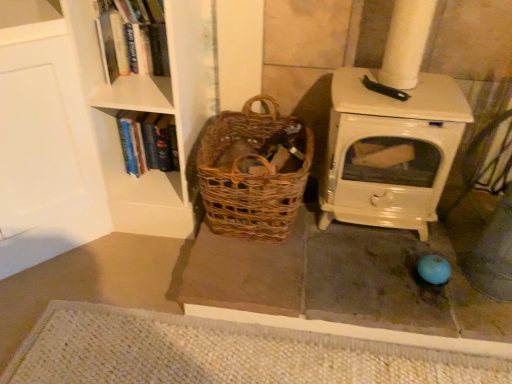
Question: Is hardcover book at upper left, which is the 2th book in back-to-front order, in front of or behind hardcover book at left, the 2th book from the top, in the image?

Choices:
 (A) behind
 (B) front

Answer: (B)

Question: In terms of width, does hardcover book at upper left, the 2th book positioned from the bottom, look wider or thinner when compared to hardcover book at left, which is the first book in bottom-to-top order?

Choices:
 (A) wide
 (B) thin

Answer: (B)

Question: Considering the real-world distances, which object is farthest from the hardcover book at upper left, the 2th book positioned from the bottom?

Choices:
 (A) white woven mat at lower center
 (B) woven brown basket at center
 (C) hardcover book at left, placed as the first book when sorted from back to front

Answer: (A)

Question: Considering the real-world distances, which object is closest to the hardcover book at left, which is the first book in bottom-to-top order?

Choices:
 (A) white woven mat at lower center
 (B) woven brown basket at center
 (C) hardcover book at upper left, the 2th book positioned from the bottom

Answer: (C)